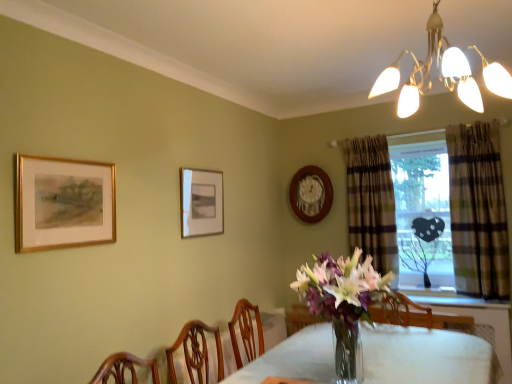
Question: From the image's perspective, is plaid fabric curtain at right, marked as the first curtain in a left-to-right arrangement, under gold-framed painting at upper left, acting as the 3th picture frame starting from the right?

Choices:
 (A) yes
 (B) no

Answer: (A)

Question: Does plaid fabric curtain at right, the 2th curtain positioned from the right, turn towards gold-framed painting at upper left, placed as the third picture frame when sorted from back to front?

Choices:
 (A) yes
 (B) no

Answer: (B)

Question: Is plaid fabric curtain at right, which is the 2th curtain in front-to-back order, wider than gold-framed painting at upper left, positioned as the 1th picture frame in front-to-back order?

Choices:
 (A) no
 (B) yes

Answer: (B)

Question: Is plaid fabric curtain at right, which is the 2th curtain in front-to-back order, turned away from gold-framed painting at upper left, placed as the third picture frame when sorted from back to front?

Choices:
 (A) yes
 (B) no

Answer: (B)

Question: Considering the relative sizes of plaid fabric curtain at right, which is the 2th curtain in front-to-back order, and gold-framed painting at upper left, placed as the third picture frame when sorted from back to front, in the image provided, is plaid fabric curtain at right, which is the 2th curtain in front-to-back order, thinner than gold-framed painting at upper left, placed as the third picture frame when sorted from back to front,?

Choices:
 (A) yes
 (B) no

Answer: (B)

Question: Is gold-framed painting at upper left, placed as the third picture frame when sorted from back to front, a part of plaid fabric curtain at right, the 2th curtain positioned from the right?

Choices:
 (A) no
 (B) yes

Answer: (A)

Question: Considering the relative positions of clear glass table at center and gold-framed painting at upper left, acting as the 3th picture frame starting from the right, in the image provided, is clear glass table at center to the right of gold-framed painting at upper left, acting as the 3th picture frame starting from the right, from the viewer's perspective?

Choices:
 (A) no
 (B) yes

Answer: (B)

Question: Does clear glass table at center have a greater width compared to gold-framed painting at upper left, placed as the third picture frame when sorted from back to front?

Choices:
 (A) no
 (B) yes

Answer: (B)

Question: Would you say clear glass table at center is a long distance from gold-framed painting at upper left, placed as the third picture frame when sorted from back to front?

Choices:
 (A) yes
 (B) no

Answer: (A)

Question: Considering the relative sizes of clear glass table at center and gold-framed painting at upper left, acting as the 3th picture frame starting from the right, in the image provided, is clear glass table at center smaller than gold-framed painting at upper left, acting as the 3th picture frame starting from the right,?

Choices:
 (A) no
 (B) yes

Answer: (A)

Question: From a real-world perspective, is clear glass table at center beneath gold-framed painting at upper left, the first picture frame from the left?

Choices:
 (A) yes
 (B) no

Answer: (A)

Question: Can you confirm if clear glass table at center is taller than gold-framed painting at upper left, acting as the 3th picture frame starting from the right?

Choices:
 (A) no
 (B) yes

Answer: (B)

Question: Is plaid fabric curtain at right, which ranks as the 1th curtain in back-to-front order, positioned before wooden clock at upper center, acting as the 1th picture frame starting from the right?

Choices:
 (A) no
 (B) yes

Answer: (B)